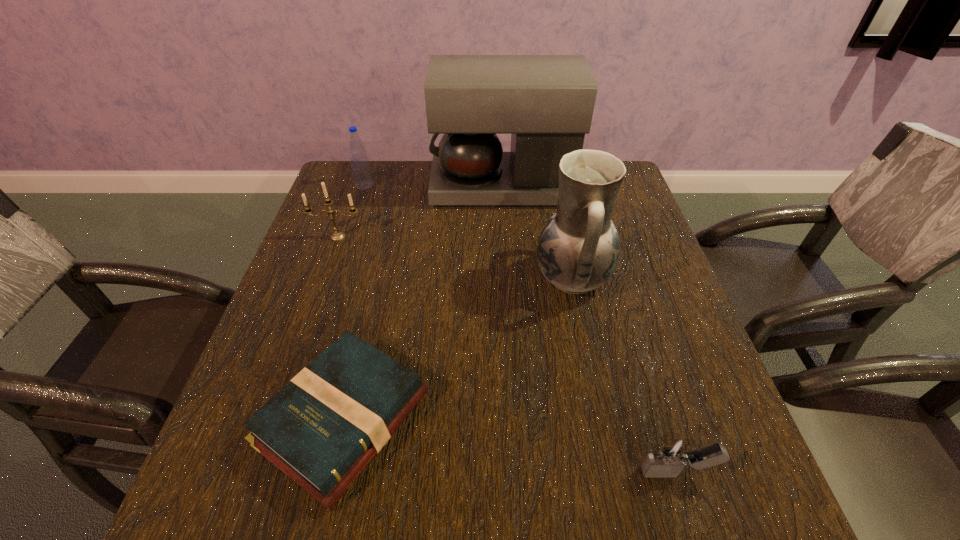
You are a GUI agent. You are given a task and a screenshot of the screen. Output one action in this format:
    pyautogui.click(x=<x>, y=<y>)
    Task: Click on the coffee maker
    The width and height of the screenshot is (960, 540).
    Given the screenshot: What is the action you would take?
    pyautogui.click(x=546, y=102)

I want to click on the fourth farthest object, so click(x=578, y=249).

Identify the location of water bottle. (361, 170).

At what (x,y) coordinates should I click in order to perform the action: click on candle. Please return your answer as a coordinate pair (x, y). Looking at the image, I should click on (337, 235).

I want to click on igniter, so click(x=673, y=452).

The image size is (960, 540). I want to click on the shortest object, so click(x=322, y=429).

Locate an element on the screen. This screenshot has height=540, width=960. vacant space located on the carafe side of the coffee maker is located at coordinates (329, 187).

What are the coordinates of `vacant area situated 0.110m on the carafe side of the coffee maker` in the screenshot? It's located at (395, 187).

You are a GUI agent. You are given a task and a screenshot of the screen. Output one action in this format:
    pyautogui.click(x=<x>, y=<y>)
    Task: Click on the free space located on the carafe side of the coffee maker
    
    Given the screenshot: What is the action you would take?
    pyautogui.click(x=333, y=187)

Locate an element on the screen. This screenshot has height=540, width=960. vacant area located on the front-facing side of the third nearest object is located at coordinates (466, 278).